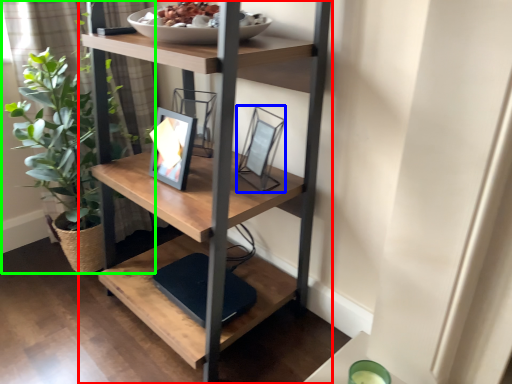
Question: Which is farther away from shelf (highlighted by a red box)? picture frame (highlighted by a blue box) or houseplant (highlighted by a green box)?

Choices:
 (A) picture frame
 (B) houseplant

Answer: (B)